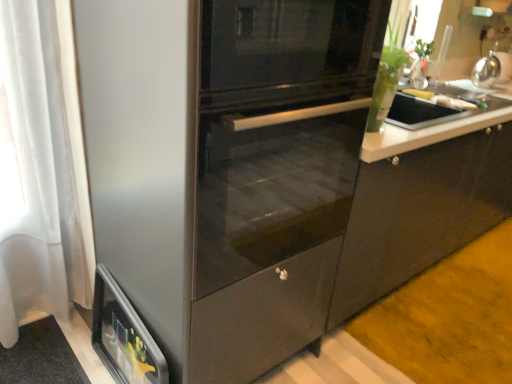
Question: From the image's perspective, is stainless steel fridge at center above or below satin silver kettle at upper right?

Choices:
 (A) above
 (B) below

Answer: (B)

Question: Choose the correct answer: Is stainless steel fridge at center inside satin silver kettle at upper right or outside it?

Choices:
 (A) inside
 (B) outside

Answer: (B)

Question: Considering the real-world distances, which object is closest to the white glossy plate at upper right, positioned as the second food in back-to-front order?

Choices:
 (A) metallic silver toaster at lower left
 (B) stainless steel fridge at center
 (C) yellow matte banana at upper right, the 1th food when ordered from back to front
 (D) satin silver kettle at upper right

Answer: (C)

Question: Estimate the real-world distances between objects in this image. Which object is closer to the satin silver kettle at upper right?

Choices:
 (A) stainless steel fridge at center
 (B) white glossy plate at upper right, positioned as the 1th food in front-to-back order
 (C) metallic silver toaster at lower left
 (D) yellow matte banana at upper right, the 1th food when ordered from back to front

Answer: (D)